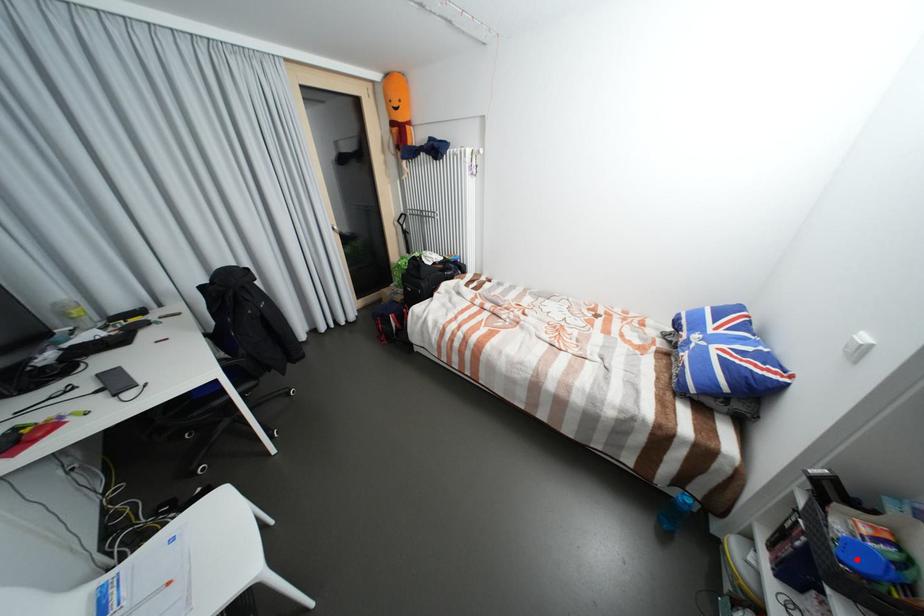
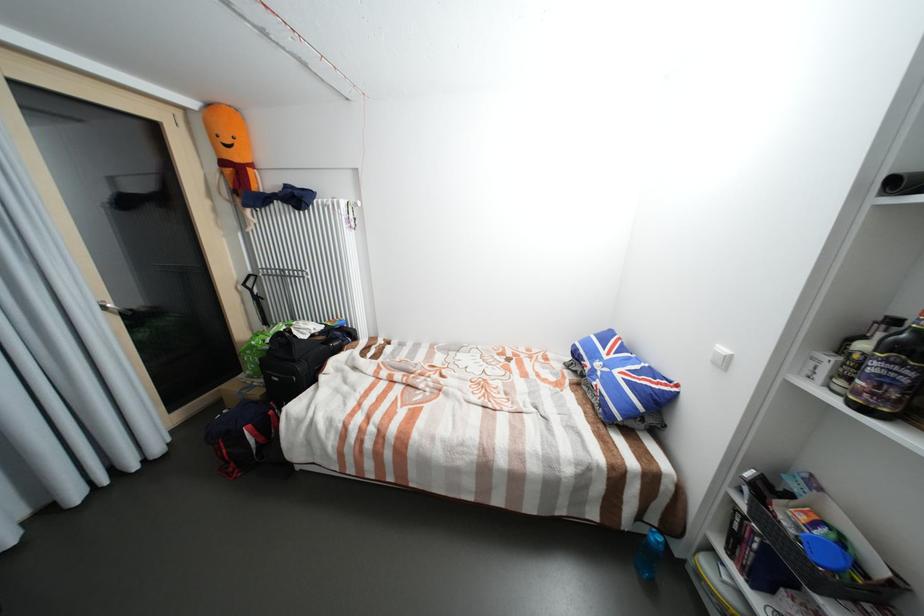
In the second image, find the point that corresponds to the highlighted location in the first image.

(828, 560)